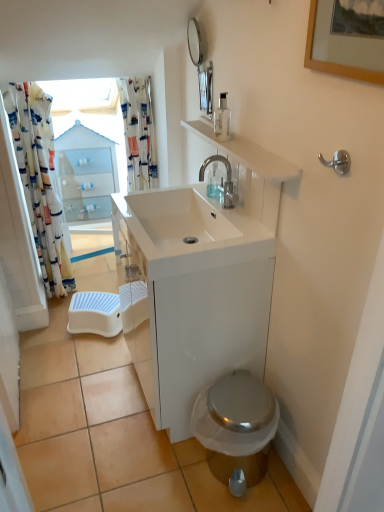
Locate an element on the screen. The image size is (384, 512). free point above metallic silver trash can at lower right (from a real-world perspective) is located at coordinates 105,414.